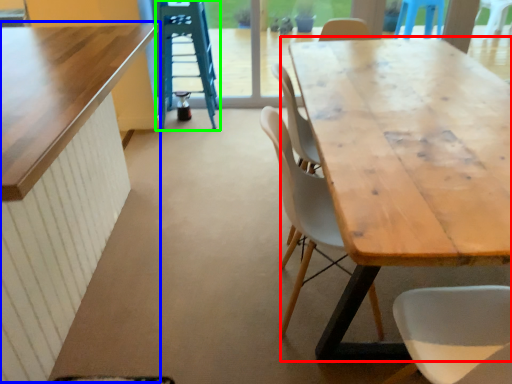
Question: Which is nearer to the table (highlighted by a red box)? table (highlighted by a blue box) or ladder (highlighted by a green box).

Choices:
 (A) table
 (B) ladder

Answer: (A)